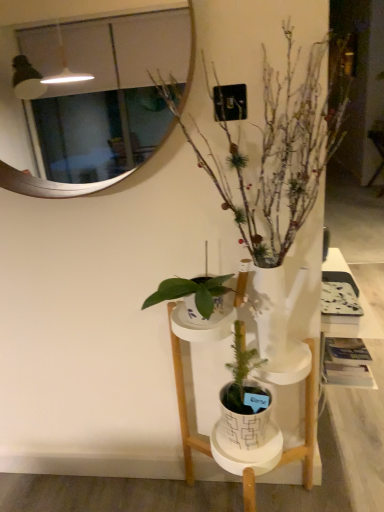
Question: Is white matte vase at center thinner than white ceramic pot at center?

Choices:
 (A) no
 (B) yes

Answer: (B)

Question: Does white matte vase at center have a smaller size compared to white ceramic pot at center?

Choices:
 (A) no
 (B) yes

Answer: (B)

Question: Considering the relative sizes of white matte vase at center and white ceramic pot at center in the image provided, is white matte vase at center taller than white ceramic pot at center?

Choices:
 (A) yes
 (B) no

Answer: (A)

Question: Is white matte vase at center directly adjacent to white ceramic pot at center?

Choices:
 (A) no
 (B) yes

Answer: (A)

Question: From a real-world perspective, is white matte vase at center physically below white ceramic pot at center?

Choices:
 (A) no
 (B) yes

Answer: (A)

Question: Do you think white ceramic pot at center is within white matte vase at center, or outside of it?

Choices:
 (A) outside
 (B) inside

Answer: (A)

Question: Considering the positions of white ceramic pot at center and white matte vase at center in the image, is white ceramic pot at center wider or thinner than white matte vase at center?

Choices:
 (A) wide
 (B) thin

Answer: (A)

Question: Based on their positions, is white ceramic pot at center located to the left or right of white matte vase at center?

Choices:
 (A) right
 (B) left

Answer: (B)

Question: Is white ceramic pot at center in front of or behind white matte vase at center in the image?

Choices:
 (A) front
 (B) behind

Answer: (B)

Question: Is white matte vase at center bigger or smaller than white glossy mirror at upper center?

Choices:
 (A) small
 (B) big

Answer: (B)

Question: Is white matte vase at center in front of or behind white glossy mirror at upper center in the image?

Choices:
 (A) front
 (B) behind

Answer: (A)

Question: Visually, is white matte vase at center positioned to the left or to the right of white glossy mirror at upper center?

Choices:
 (A) right
 (B) left

Answer: (A)

Question: Is white matte vase at center taller or shorter than white glossy mirror at upper center?

Choices:
 (A) tall
 (B) short

Answer: (A)

Question: Is white glossy mirror at upper center taller or shorter than white matte vase at center?

Choices:
 (A) tall
 (B) short

Answer: (B)

Question: In the image, is white glossy mirror at upper center positioned in front of or behind white matte vase at center?

Choices:
 (A) behind
 (B) front

Answer: (A)